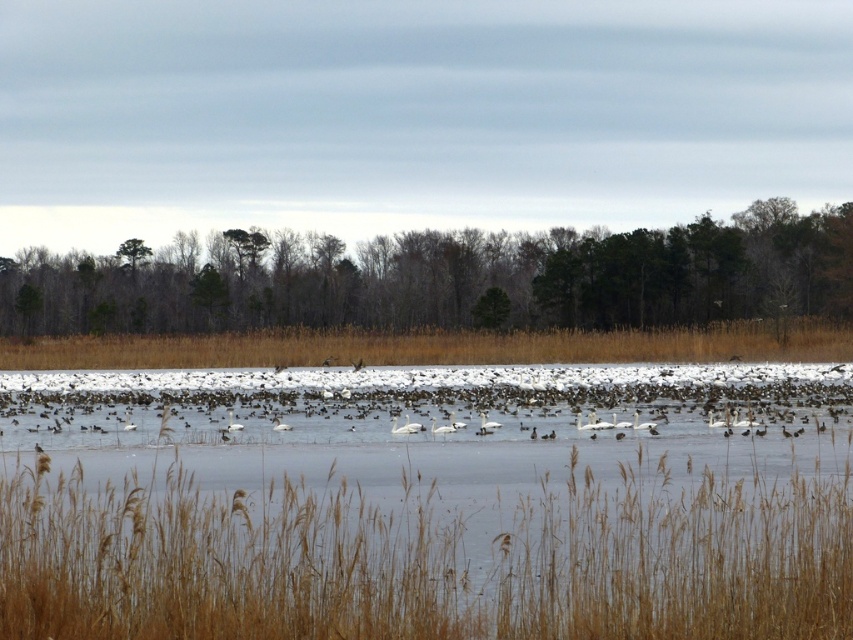
Question: Which point is closer to the camera?

Choices:
 (A) (231, 422)
 (B) (764, 328)
 (C) (606, 566)
 (D) (277, 289)

Answer: (C)

Question: Does brown dry grass at center have a larger size compared to white glossy swan at center?

Choices:
 (A) no
 (B) yes

Answer: (B)

Question: Among these objects, which one is nearest to the camera?

Choices:
 (A) brown dry grass at lower center
 (B) white matte swan at center
 (C) brown dry grass at center

Answer: (A)

Question: Estimate the real-world distances between objects in this image. Which object is closer to the brown dry grass at lower center?

Choices:
 (A) brown/dry grass at center
 (B) brown dry grass at center
 (C) white matte swan at center
 (D) white glossy swan at center

Answer: (D)

Question: Is brown dry grass at lower center positioned in front of white matte swan at center?

Choices:
 (A) yes
 (B) no

Answer: (A)

Question: Is brown dry grass at lower center in front of brown dry grass at center?

Choices:
 (A) no
 (B) yes

Answer: (B)